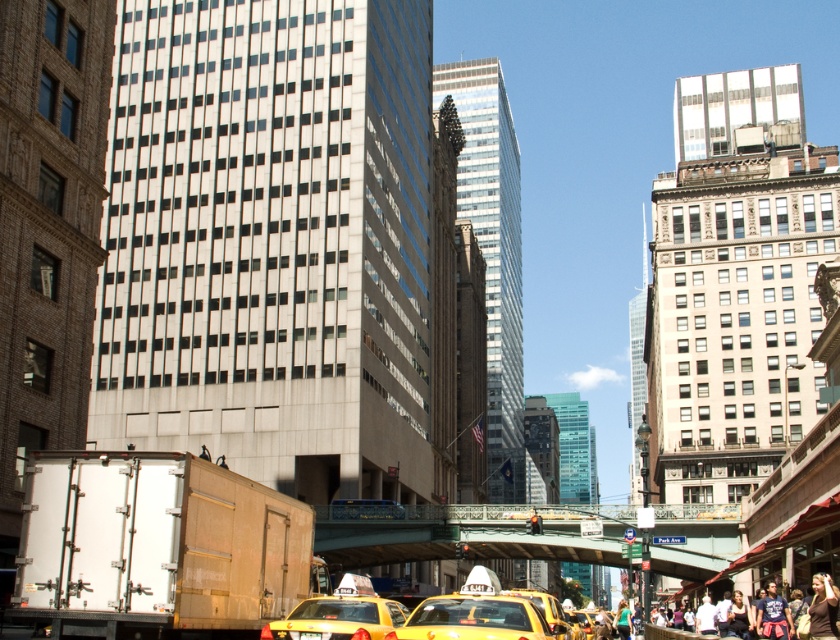
Question: Considering the relative positions of green metal bridge at center and yellow matte taxi at lower center in the image provided, where is green metal bridge at center located with respect to yellow matte taxi at lower center?

Choices:
 (A) left
 (B) right

Answer: (B)

Question: Which of the following is the closest to the observer?

Choices:
 (A) yellow matte taxi at lower center
 (B) yellow matte taxi at center
 (C) green metal bridge at center
 (D) brown leather jacket at lower right

Answer: (B)

Question: Does yellow matte taxi at center have a lesser width compared to yellow matte taxi at lower center?

Choices:
 (A) yes
 (B) no

Answer: (B)

Question: Among these points, which one is nearest to the camera?

Choices:
 (A) (714, 552)
 (B) (823, 627)

Answer: (B)

Question: Among these points, which one is nearest to the camera?

Choices:
 (A) click(x=770, y=596)
 (B) click(x=491, y=509)
 (C) click(x=315, y=628)
 (D) click(x=819, y=609)

Answer: (C)

Question: Can you confirm if yellow matte taxi at center is bigger than denim jacket at lower right?

Choices:
 (A) yes
 (B) no

Answer: (A)